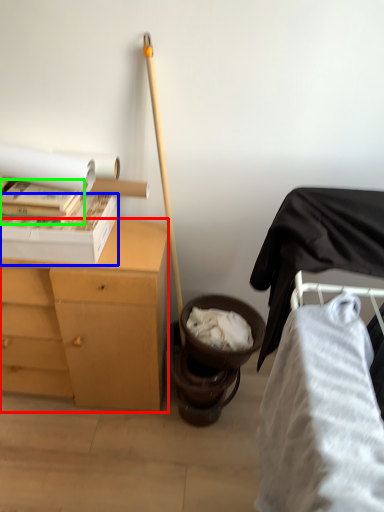
Question: Which object is the farthest from desk (highlighted by a red box)? Choose among these: box (highlighted by a blue box) or book (highlighted by a green box).

Choices:
 (A) box
 (B) book

Answer: (B)